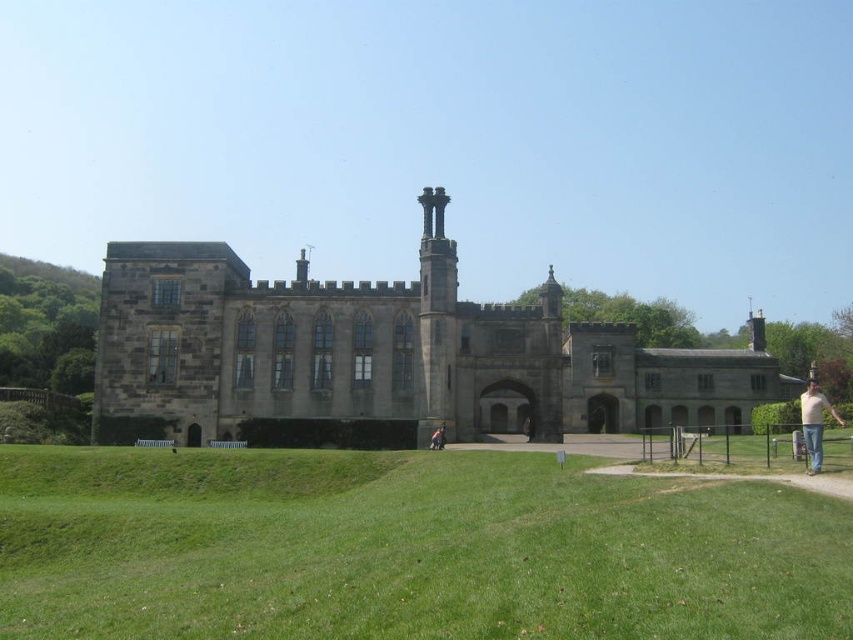
Question: Where is green grassy at lower center located in relation to light beige jeans at lower right in the image?

Choices:
 (A) above
 (B) below

Answer: (B)

Question: Which of the following is the closest to the observer?

Choices:
 (A) green grassy at lower center
 (B) light beige jeans at lower right

Answer: (A)

Question: Is green grassy at lower center behind light beige jeans at lower right?

Choices:
 (A) no
 (B) yes

Answer: (A)

Question: Is green grassy at lower center positioned behind light beige jeans at lower right?

Choices:
 (A) yes
 (B) no

Answer: (B)

Question: Which point appears farthest from the camera in this image?

Choices:
 (A) (825, 401)
 (B) (612, 490)

Answer: (A)